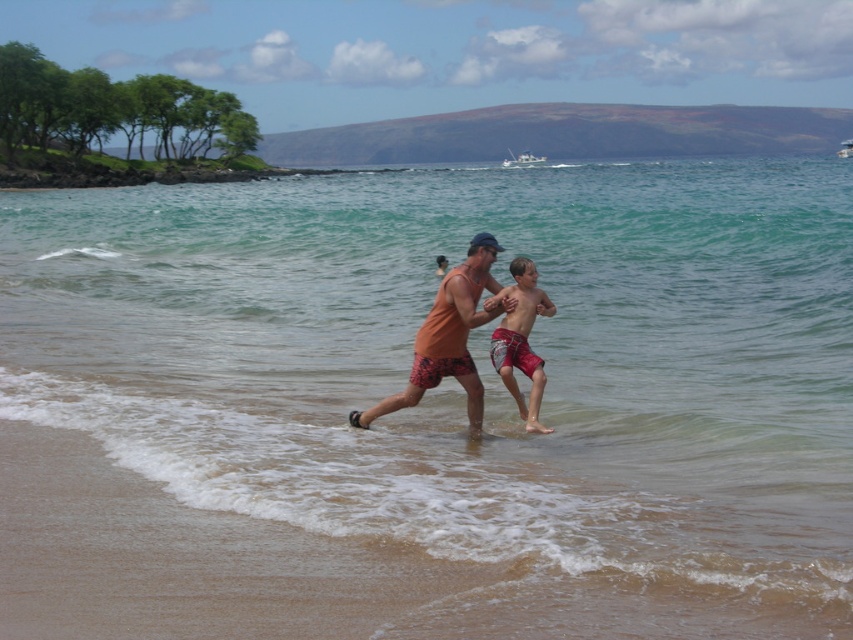
Is orange cotton tank top at center further to the viewer compared to red plaid shorts at center?

No, it is not.

Image resolution: width=853 pixels, height=640 pixels. What do you see at coordinates (448, 337) in the screenshot?
I see `orange cotton tank top at center` at bounding box center [448, 337].

Where is `orange cotton tank top at center`? orange cotton tank top at center is located at coordinates (448, 337).